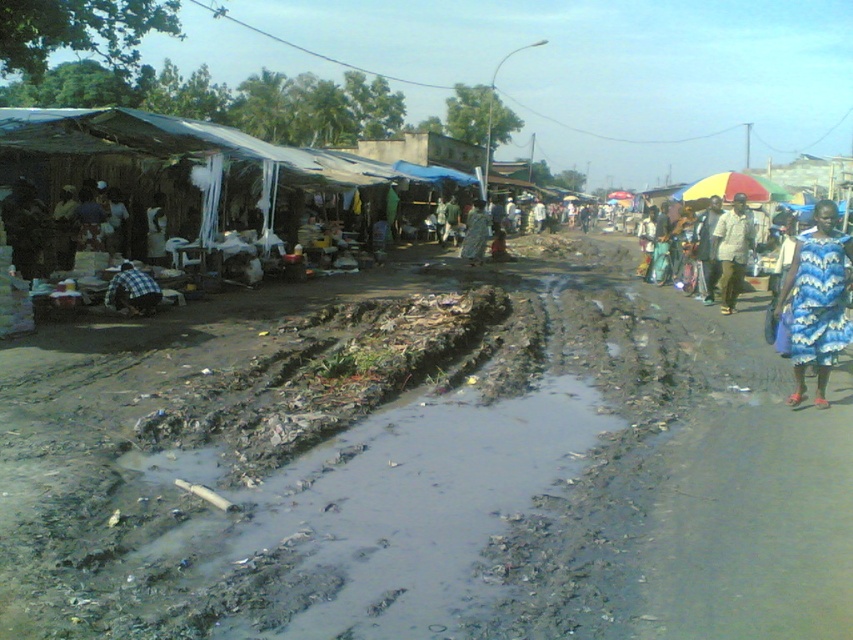
Can you confirm if checkered fabric shirt at left is taller than blue printed dress at center?

In fact, checkered fabric shirt at left may be shorter than blue printed dress at center.

How far apart are checkered fabric shirt at left and blue printed dress at center?

They are 11.95 meters apart.

Locate an element on the screen. checkered fabric shirt at left is located at coordinates (132, 291).

Identify the location of checkered fabric shirt at left. (132, 291).

Who is more distant from viewer, (811, 316) or (729, 209)?

Point (729, 209)

Can you confirm if blue printed dress at lower right is positioned below light brown fabric pants at right?

Yes, blue printed dress at lower right is below light brown fabric pants at right.

Between point (845, 248) and point (732, 288), which one is positioned in front?

Positioned in front is point (845, 248).

Where is `blue printed dress at lower right`? The image size is (853, 640). blue printed dress at lower right is located at coordinates (816, 300).

Is blue printed dress at lower right in front of blue printed dress at center?

Yes, it is.

Is point (833, 236) closer to viewer compared to point (476, 241)?

Yes.

Is point (825, 227) positioned after point (473, 212)?

That is False.

You are a GUI agent. You are given a task and a screenshot of the screen. Output one action in this format:
    pyautogui.click(x=<x>, y=<y>)
    Task: Click on the blue printed dress at lower right
    
    Given the screenshot: What is the action you would take?
    pyautogui.click(x=816, y=300)